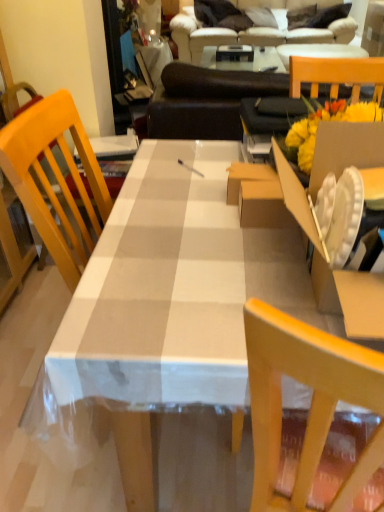
Question: Is beige fabric couch at upper center in front of or behind white checkered tablecloth at center in the image?

Choices:
 (A) front
 (B) behind

Answer: (B)

Question: From the image's perspective, is beige fabric couch at upper center above or below white checkered tablecloth at center?

Choices:
 (A) above
 (B) below

Answer: (A)

Question: Estimate the real-world distances between objects in this image. Which object is closer to the wooden chair at right?

Choices:
 (A) cardboard box at right
 (B) beige fabric couch at upper center
 (C) white checkered tablecloth at center

Answer: (A)

Question: Estimate the real-world distances between objects in this image. Which object is farther from the white checkered tablecloth at center?

Choices:
 (A) beige fabric couch at upper center
 (B) cardboard box at right
 (C) wooden chair at right

Answer: (A)